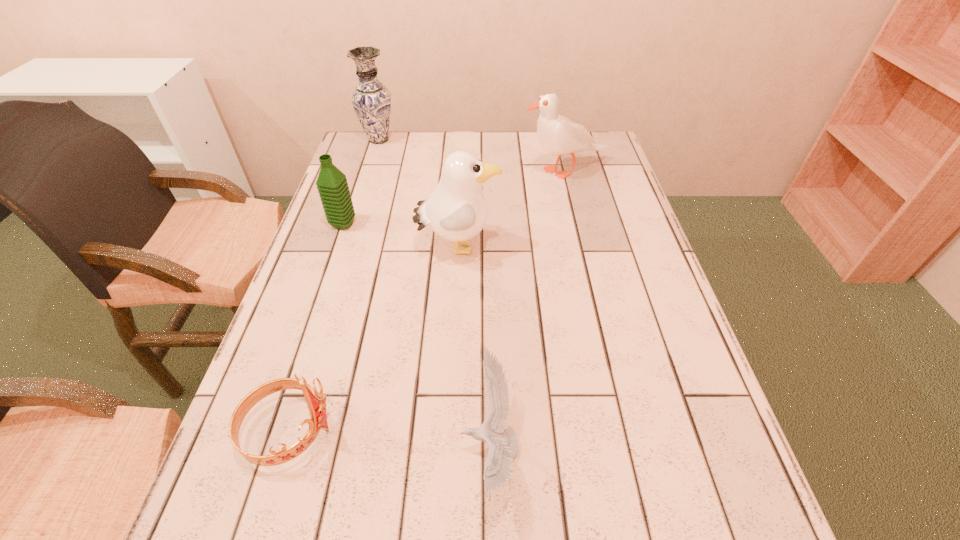
The image size is (960, 540). I want to click on vacant space at the far left corner of the desktop, so click(362, 159).

I want to click on free space at the far right corner of the desktop, so click(592, 136).

This screenshot has width=960, height=540. Identify the location of unoccupied position between the vase and the shortest object. (435, 293).

You are a GUI agent. You are given a task and a screenshot of the screen. Output one action in this format:
    pyautogui.click(x=<x>, y=<y>)
    Task: Click on the free spot between the fifth tallest object and the water bottle
    Image resolution: width=960 pixels, height=540 pixels.
    Given the screenshot: What is the action you would take?
    pyautogui.click(x=317, y=328)

Where is `vacant point located between the nearest gull and the water bottle`? Image resolution: width=960 pixels, height=540 pixels. vacant point located between the nearest gull and the water bottle is located at coordinates (417, 335).

Find the location of `vacant space in between the farthest gull and the fifth tallest object`. vacant space in between the farthest gull and the fifth tallest object is located at coordinates (428, 301).

At what (x,y) coordinates should I click in order to perform the action: click on free point between the water bottle and the fifth tallest object. Please return your answer as a coordinate pair (x, y). This screenshot has height=540, width=960. Looking at the image, I should click on (317, 328).

Locate an element on the screen. The width and height of the screenshot is (960, 540). vacant point located between the nearest gull and the farthest object is located at coordinates (435, 293).

Identify the location of empty space that is in between the water bottle and the second farthest gull. This screenshot has width=960, height=540. (400, 236).

At what (x,y) coordinates should I click in order to perform the action: click on unoccupied position between the second nearest gull and the vase. Please return your answer as a coordinate pair (x, y). Looking at the image, I should click on (419, 194).